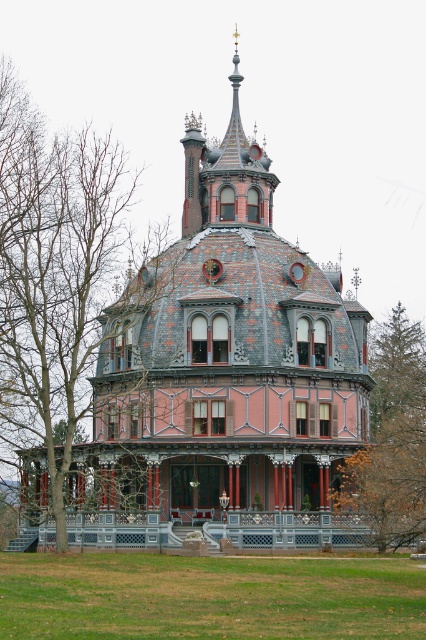
Question: From the image, what is the correct spatial relationship of brown leafless tree at left in relation to brown wood tree at right?

Choices:
 (A) left
 (B) right

Answer: (A)

Question: Is brown leafless tree at left below brown wood tree at right?

Choices:
 (A) no
 (B) yes

Answer: (A)

Question: Which of the following is the farthest from the observer?

Choices:
 (A) brown wood tree at right
 (B) brown leafless tree at left

Answer: (A)

Question: Observing the image, what is the correct spatial positioning of brown leafless tree at left in reference to brown wood tree at right?

Choices:
 (A) left
 (B) right

Answer: (A)